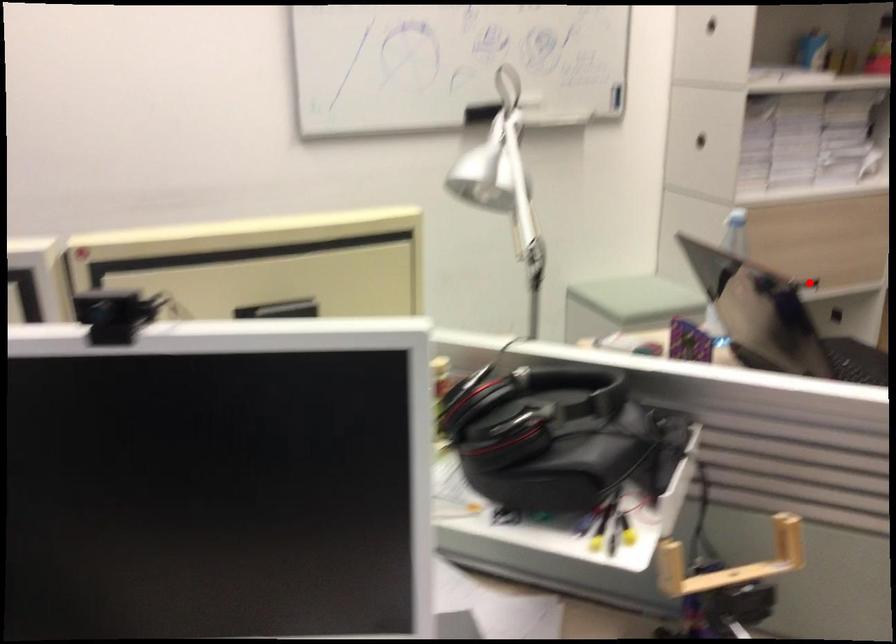
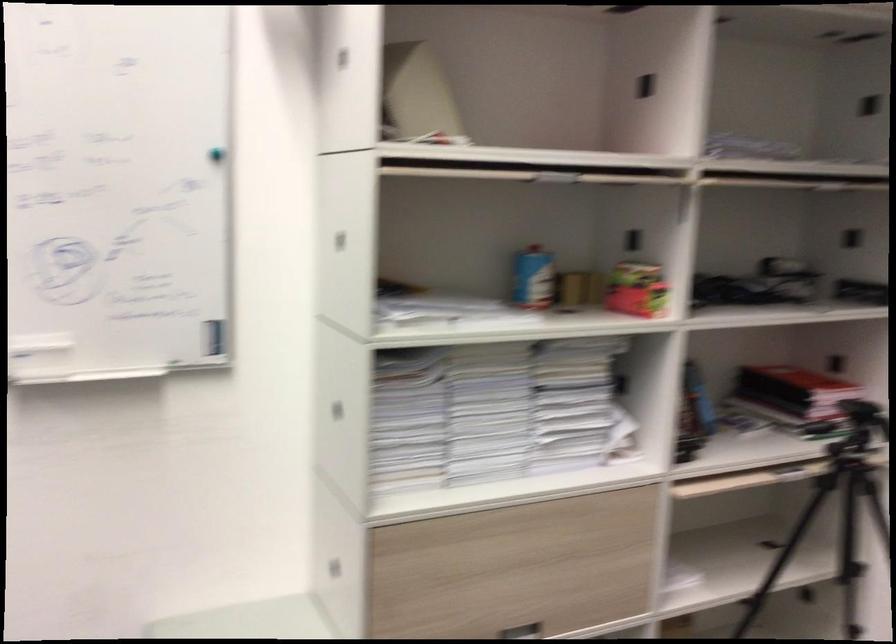
The point at the highlighted location is marked in the first image. Where is the corresponding point in the second image?

(522, 630)